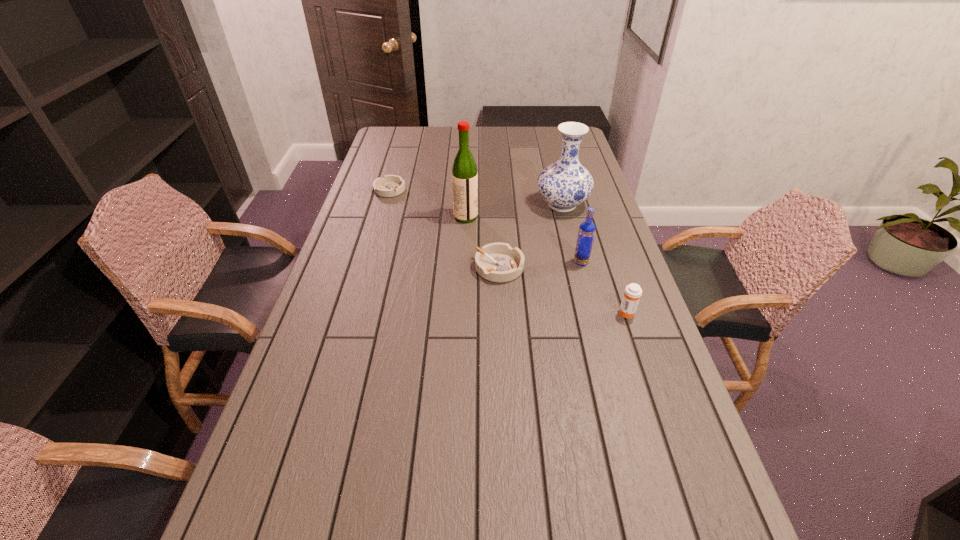
Locate an element on the screen. The height and width of the screenshot is (540, 960). free space located on the left of the fifth tallest object is located at coordinates (348, 267).

The width and height of the screenshot is (960, 540). Identify the location of free location located on the front of the second tallest object. (568, 231).

Find the location of a particular element. free space located on the front of the vodka is located at coordinates (606, 355).

The image size is (960, 540). Find the location of `vacant area located on the label of the liquor`. vacant area located on the label of the liquor is located at coordinates (512, 217).

Identify the location of free location located on the left of the fourth tallest object. (564, 312).

Locate an element on the screen. This screenshot has width=960, height=540. object located in the left edge section of the desktop is located at coordinates (390, 185).

Identify the location of vase that is positioned at the right edge. 566,183.

At what (x,y) coordinates should I click in order to perform the action: click on vodka that is at the right edge. Please return your answer as a coordinate pair (x, y). The image size is (960, 540). Looking at the image, I should click on (586, 233).

The height and width of the screenshot is (540, 960). What are the coordinates of `medicine present at the right edge` in the screenshot? It's located at (632, 293).

Locate an element on the screen. free space at the far edge is located at coordinates (492, 146).